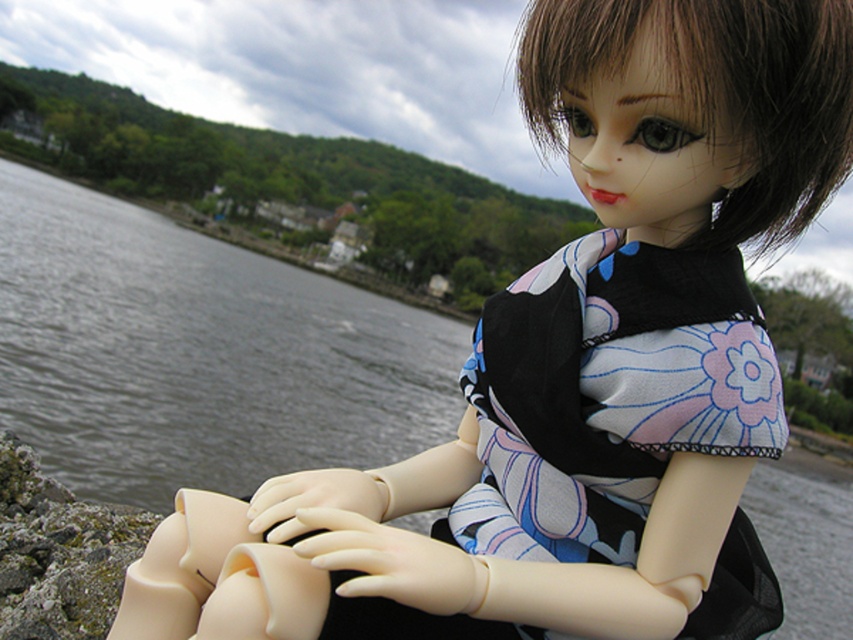
Question: Which point is farther to the camera?

Choices:
 (A) (523, 492)
 (B) (200, 419)

Answer: (B)

Question: Is gray water at left to the right of silky floral dress at center from the viewer's perspective?

Choices:
 (A) no
 (B) yes

Answer: (A)

Question: Which point is farther to the camera?

Choices:
 (A) gray water at left
 (B) silky floral dress at center

Answer: (A)

Question: Can you confirm if gray water at left is smaller than silky floral dress at center?

Choices:
 (A) no
 (B) yes

Answer: (A)

Question: Is gray water at left closer to the viewer compared to silky floral dress at center?

Choices:
 (A) yes
 (B) no

Answer: (B)